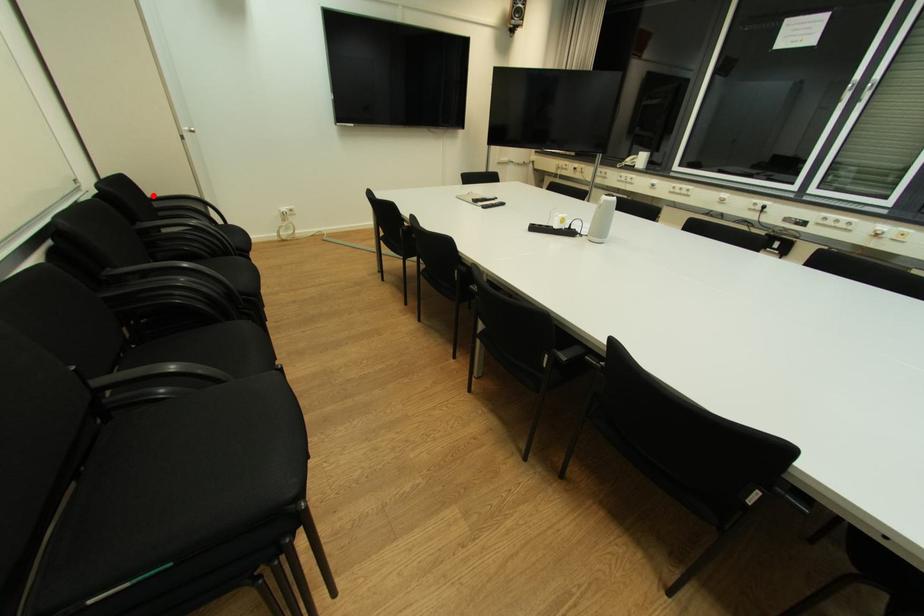
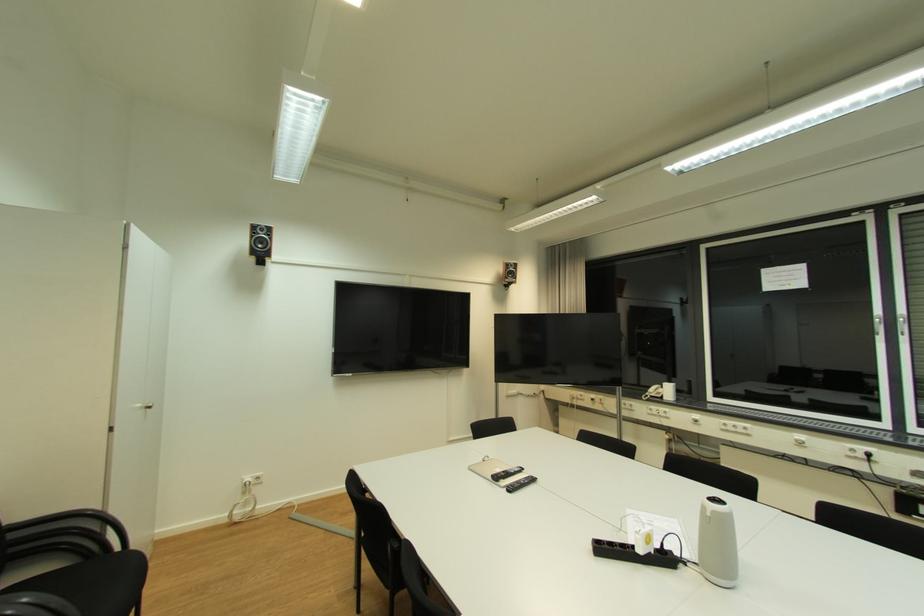
Find the pixel in the second image that matches the highlighted location in the first image.

(11, 525)